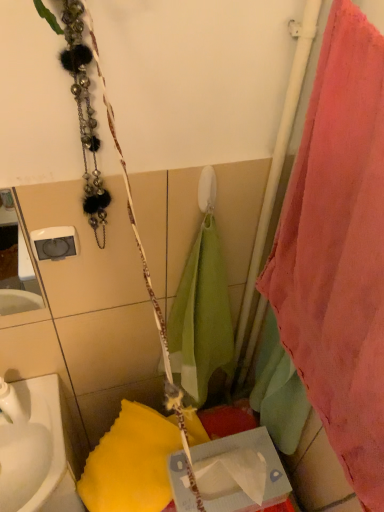
Question: From the image's perspective, does white glossy sink at lower left appear lower than pink fabric towel at right?

Choices:
 (A) yes
 (B) no

Answer: (A)

Question: From a real-world perspective, is white glossy sink at lower left positioned under pink fabric towel at right based on gravity?

Choices:
 (A) yes
 (B) no

Answer: (A)

Question: Considering the relative sizes of white glossy sink at lower left and pink fabric towel at right in the image provided, is white glossy sink at lower left smaller than pink fabric towel at right?

Choices:
 (A) yes
 (B) no

Answer: (A)

Question: Is the depth of white glossy sink at lower left greater than that of pink fabric towel at right?

Choices:
 (A) yes
 (B) no

Answer: (A)

Question: Does white glossy sink at lower left have a greater width compared to pink fabric towel at right?

Choices:
 (A) no
 (B) yes

Answer: (B)

Question: Considering the relative sizes of white glossy sink at lower left and pink fabric towel at right in the image provided, is white glossy sink at lower left shorter than pink fabric towel at right?

Choices:
 (A) yes
 (B) no

Answer: (A)

Question: Does cardboard tissue box at center have a lesser height compared to pink fabric towel at right?

Choices:
 (A) yes
 (B) no

Answer: (A)

Question: Is cardboard tissue box at center facing away from pink fabric towel at right?

Choices:
 (A) no
 (B) yes

Answer: (A)

Question: Is cardboard tissue box at center facing towards pink fabric towel at right?

Choices:
 (A) yes
 (B) no

Answer: (B)

Question: Is pink fabric towel at right located within cardboard tissue box at center?

Choices:
 (A) no
 (B) yes

Answer: (A)

Question: Is cardboard tissue box at center to the right of pink fabric towel at right from the viewer's perspective?

Choices:
 (A) no
 (B) yes

Answer: (A)

Question: Does cardboard tissue box at center have a larger size compared to pink fabric towel at right?

Choices:
 (A) yes
 (B) no

Answer: (B)

Question: From a real-world perspective, is cardboard tissue box at center below white glossy sink at lower left?

Choices:
 (A) yes
 (B) no

Answer: (B)